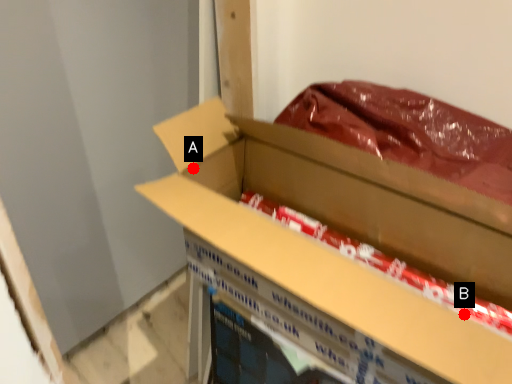
Question: Two points are circled on the image, labeled by A and B beside each circle. Which of the following is the farthest from the observer?

Choices:
 (A) A is further
 (B) B is further

Answer: (A)